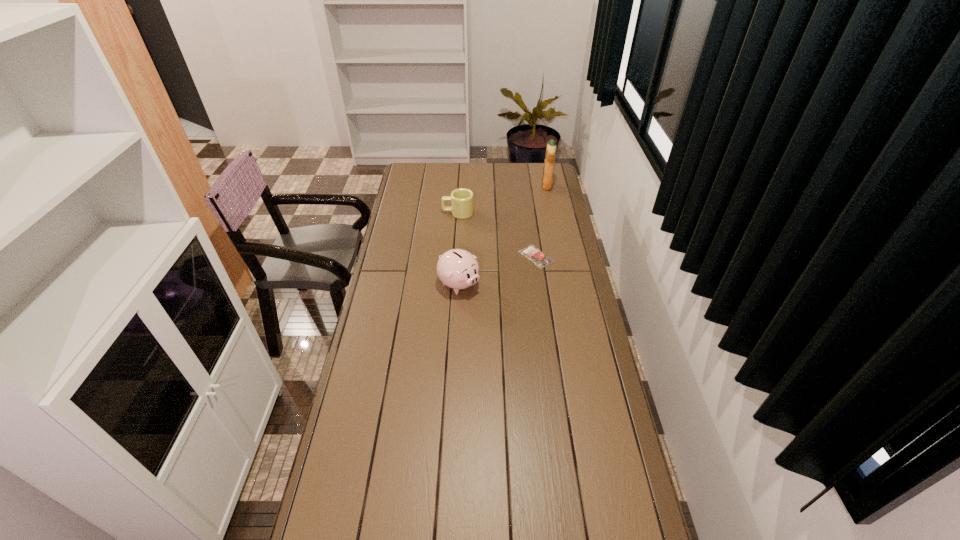
Identify the location of blank space at the far edge. (511, 183).

Locate an element on the screen. Image resolution: width=960 pixels, height=540 pixels. blank space at the left edge of the desktop is located at coordinates (387, 419).

This screenshot has height=540, width=960. In the image, there is a desktop. In order to click on free region at the right edge in this screenshot , I will do `click(570, 349)`.

Identify the location of free space at the far right corner of the desktop. This screenshot has width=960, height=540. (557, 173).

I want to click on unoccupied position between the third nearest object and the steak, so click(x=497, y=235).

You are a GUI agent. You are given a task and a screenshot of the screen. Output one action in this format:
    pyautogui.click(x=<x>, y=<y>)
    Task: Click on the vacant area between the detergent and the shortest object
    This screenshot has height=540, width=960.
    Given the screenshot: What is the action you would take?
    pyautogui.click(x=541, y=221)

Where is `free spot between the third object from left to right and the nearest object`? Image resolution: width=960 pixels, height=540 pixels. free spot between the third object from left to right and the nearest object is located at coordinates (497, 271).

This screenshot has height=540, width=960. Identify the location of free area in between the shortest object and the third nearest object. (497, 235).

Image resolution: width=960 pixels, height=540 pixels. I want to click on free space between the second farthest object and the tallest object, so click(502, 200).

You are a GUI agent. You are given a task and a screenshot of the screen. Output one action in this format:
    pyautogui.click(x=<x>, y=<y>)
    Task: Click on the free spot between the second shortest object and the piggy bank
    The height and width of the screenshot is (540, 960).
    Given the screenshot: What is the action you would take?
    pyautogui.click(x=459, y=248)